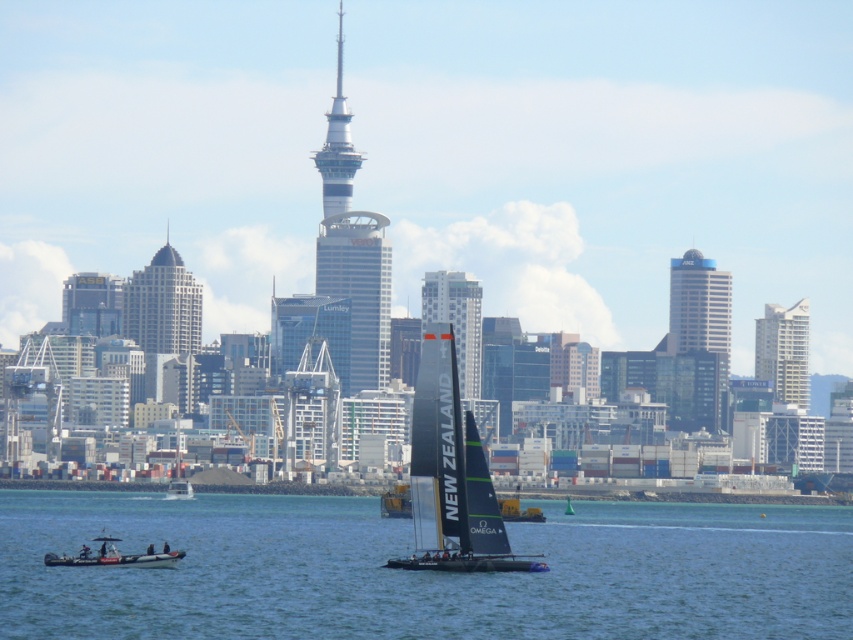
Question: Which point is farther from the camera taking this photo?

Choices:
 (A) (457, 332)
 (B) (792, 323)
 (C) (686, 291)
 (D) (465, 570)

Answer: (B)

Question: Does glassy blue skyscraper at center have a greater width compared to white glass skyscraper at center?

Choices:
 (A) yes
 (B) no

Answer: (A)

Question: In this image, where is silver glass skyscraper at center located relative to blue glass skyscraper at center?

Choices:
 (A) right
 (B) left

Answer: (B)

Question: Which object is the farthest from the white glass skyscraper at center?

Choices:
 (A) white matte boat at lower left
 (B) blue glass skyscraper at center
 (C) black sailboat at center
 (D) white glass building at upper right

Answer: (A)

Question: Is blue water at lower center further to camera compared to silver metallic tower at center?

Choices:
 (A) no
 (B) yes

Answer: (B)

Question: Which point is closer to the camera?

Choices:
 (A) white glass skyscraper at center
 (B) silver glass skyscraper at center
 (C) glassy blue skyscraper at center
 (D) blue water at lower center

Answer: (A)